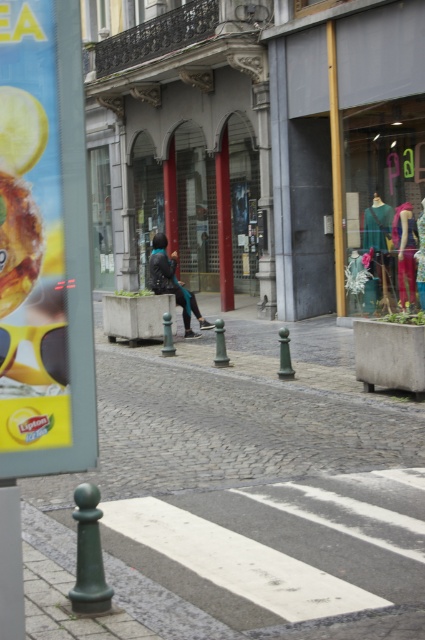
You are a delivery person who needs to place a package on the yellow plastic sign at left. Can you place the package on top of the transparent glass mannequins at center first before moving it to the sign?

The yellow plastic sign at left has a lesser height compared to transparent glass mannequins at center. Therefore, you can place the package on the transparent glass mannequins at center first before moving it to the yellow plastic sign at left.

You are a fashion designer observing a woman walking on a European street. You notice she is wearing a matte black jacket at center and a multicolored fabric dress at center right. Which piece of clothing has a greater width?

The matte black jacket at center has a greater width than the multicolored fabric dress at center right.

You are standing at the pedestrian crossing in the street scene and want to determine the distance between two points marked on the ground. The points are labeled as point (45,44) and point (158,291). Since you donot have a measuring tool, you recall that in this image, objects closer to the camera appear larger. Which point would appear larger to you?

Point (45,44) is closer to the camera than point (158,291), so it would appear larger.